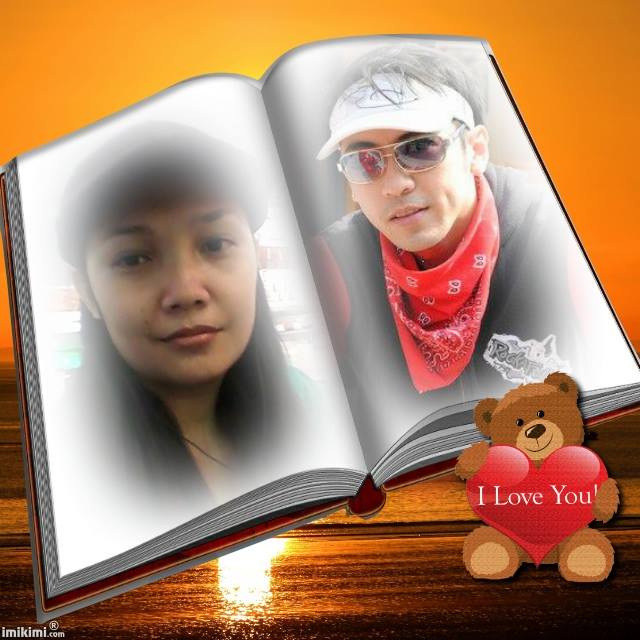
Where is `book`? The image size is (640, 640). book is located at coordinates (324, 491).